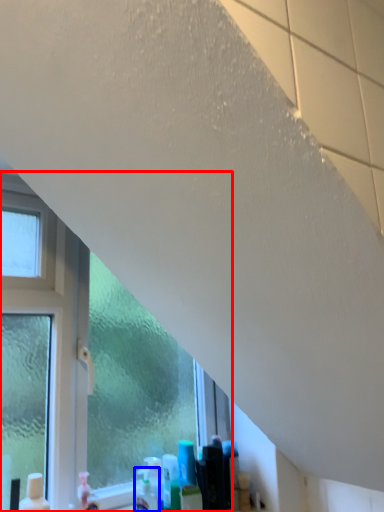
Question: Which object is further to the camera taking this photo, window (highlighted by a red box) or cleaning product (highlighted by a blue box)?

Choices:
 (A) window
 (B) cleaning product

Answer: (B)